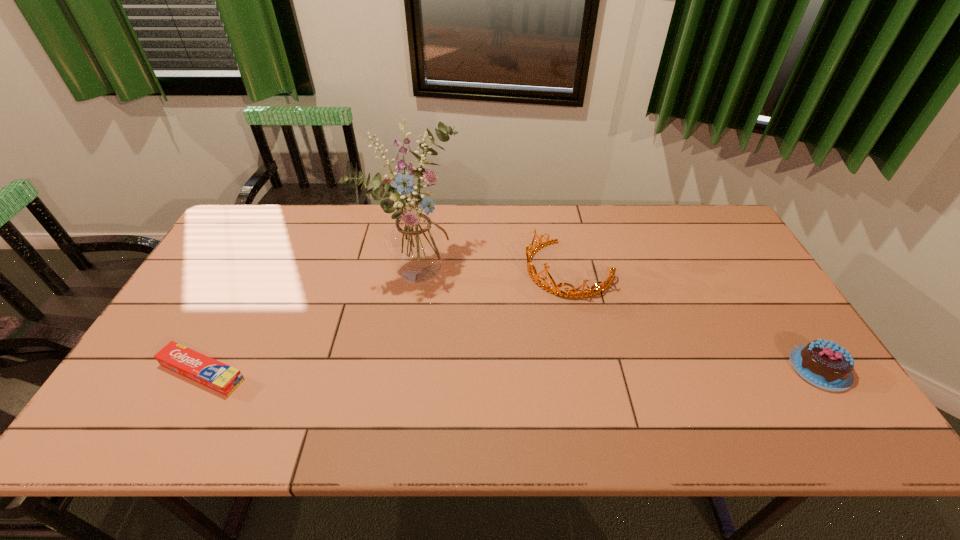
Locate an element on the screen. The image size is (960, 540). the closest object to the chocolate cake is located at coordinates (531, 268).

Identify which object is the third nearest to the rightmost object. Please provide its 2D coordinates. Your answer should be formatted as a tuple, i.e. [(x, y)], where the tuple contains the x and y coordinates of a point satisfying the conditions above.

[(198, 367)]

Where is `vacant space that satisfies the following two spatial constraints: 1. on the back side of the second tallest object; 2. on the right side of the shortest object`? The width and height of the screenshot is (960, 540). vacant space that satisfies the following two spatial constraints: 1. on the back side of the second tallest object; 2. on the right side of the shortest object is located at coordinates (258, 269).